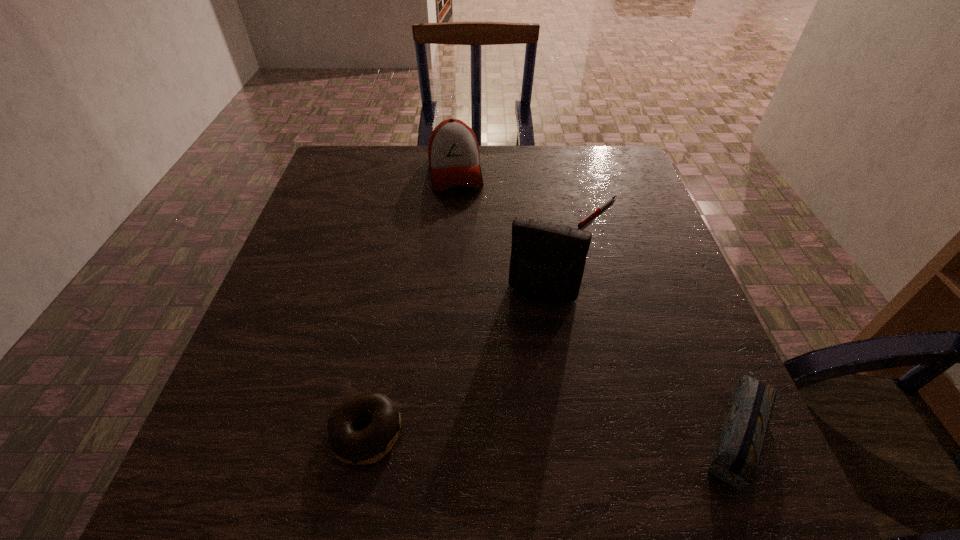
Locate an element on the screen. The width and height of the screenshot is (960, 540). vacant space situated 0.290m on the clicker of the pen is located at coordinates (591, 318).

Identify the location of vacant space located 0.170m with an open flap on the pouch. (512, 376).

Find the location of a particular element. The height and width of the screenshot is (540, 960). free space located with an open flap on the pouch is located at coordinates (512, 376).

The height and width of the screenshot is (540, 960). I want to click on vacant point located 0.050m with an open flap on the pouch, so tap(528, 326).

Identify the location of free space located 0.400m on the front-facing side of the baseball cap. The width and height of the screenshot is (960, 540). (476, 315).

Locate an element on the screen. This screenshot has height=540, width=960. free space located 0.110m on the front-facing side of the baseball cap is located at coordinates (462, 225).

Image resolution: width=960 pixels, height=540 pixels. I want to click on free spot located on the front-facing side of the baseball cap, so click(469, 270).

At what (x,y) coordinates should I click in order to perform the action: click on object that is at the far edge. Please return your answer as a coordinate pair (x, y). Looking at the image, I should click on (454, 157).

In order to click on doughnut at the near edge in this screenshot , I will do `click(366, 446)`.

I want to click on pencil box positioned at the near edge, so click(736, 460).